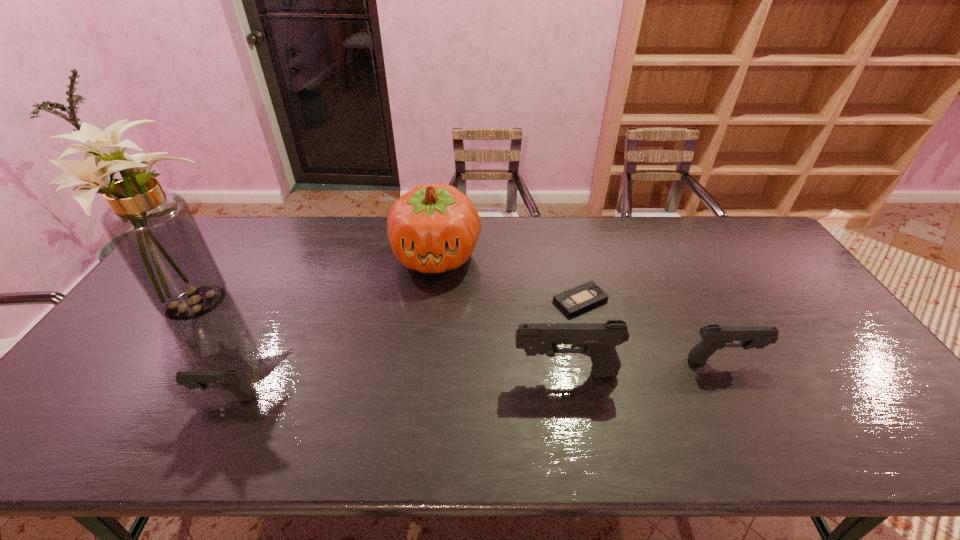
This screenshot has height=540, width=960. In order to click on the fifth tallest object in this screenshot , I will do `click(231, 380)`.

The height and width of the screenshot is (540, 960). I want to click on the leftmost pistol, so click(x=231, y=380).

This screenshot has width=960, height=540. What are the coordinates of `the second pistol from right to left` in the screenshot? It's located at (598, 341).

Where is `the second nearest object`? This screenshot has width=960, height=540. the second nearest object is located at coordinates (598, 341).

Find the location of a particular element. the third nearest object is located at coordinates (714, 337).

Find the location of a particular element. The image size is (960, 540). the farthest pistol is located at coordinates [x=714, y=337].

At what (x,y) coordinates should I click in order to perform the action: click on the fourth object from right to left. Please return your answer as a coordinate pair (x, y). This screenshot has width=960, height=540. Looking at the image, I should click on (433, 228).

This screenshot has height=540, width=960. Identify the location of pumpkin. (433, 228).

Locate an element on the screen. Image resolution: width=960 pixels, height=540 pixels. the tallest object is located at coordinates (154, 231).

The width and height of the screenshot is (960, 540). Find the location of `flower arrangement`. flower arrangement is located at coordinates (154, 231).